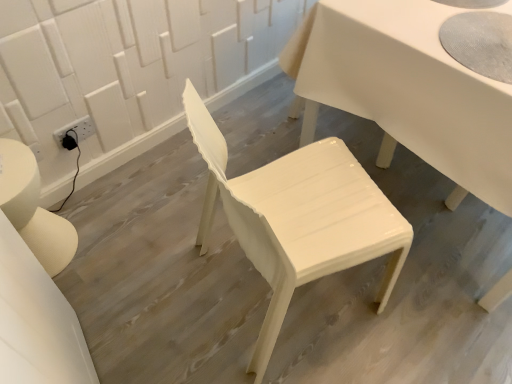
The image size is (512, 384). Identify the location of blank space to the left of glossy white chair at center. (160, 280).